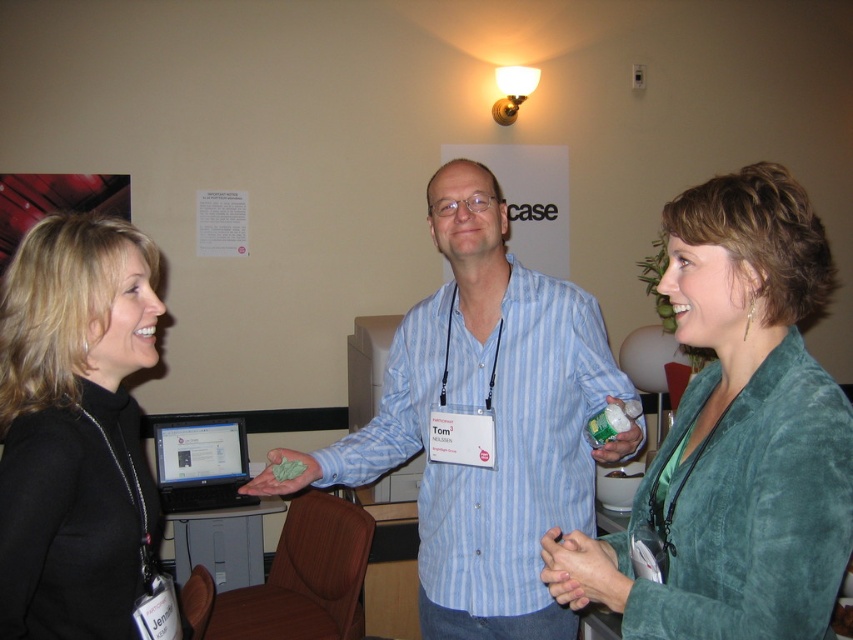
Is velvety green blazer at center positioned before smooth skin hands at center?

Yes, velvety green blazer at center is in front of smooth skin hands at center.

Which of these two, velvety green blazer at center or smooth skin hands at center, stands shorter?

With less height is smooth skin hands at center.

Which is behind, point (688, 458) or point (561, 544)?

Positioned behind is point (561, 544).

Where is `velvety green blazer at center`? velvety green blazer at center is located at coordinates (735, 435).

Which is more to the right, velvety green blazer at center or blue striped shirt at center?

velvety green blazer at center

Is velvety green blazer at center below blue striped shirt at center?

Actually, velvety green blazer at center is above blue striped shirt at center.

The image size is (853, 640). Find the location of `velvety green blazer at center`. velvety green blazer at center is located at coordinates (735, 435).

At what (x,y) coordinates should I click in order to perform the action: click on velvety green blazer at center. Please return your answer as a coordinate pair (x, y). Looking at the image, I should click on (735, 435).

Does white matte pill bottle at center appear over green matte cloth at center?

Correct, white matte pill bottle at center is located above green matte cloth at center.

Does white matte pill bottle at center have a smaller size compared to green matte cloth at center?

Yes, white matte pill bottle at center is smaller than green matte cloth at center.

Who is more distant from viewer, (606, 460) or (285, 449)?

Point (285, 449)

Find the location of a particular element. white matte pill bottle at center is located at coordinates (618, 432).